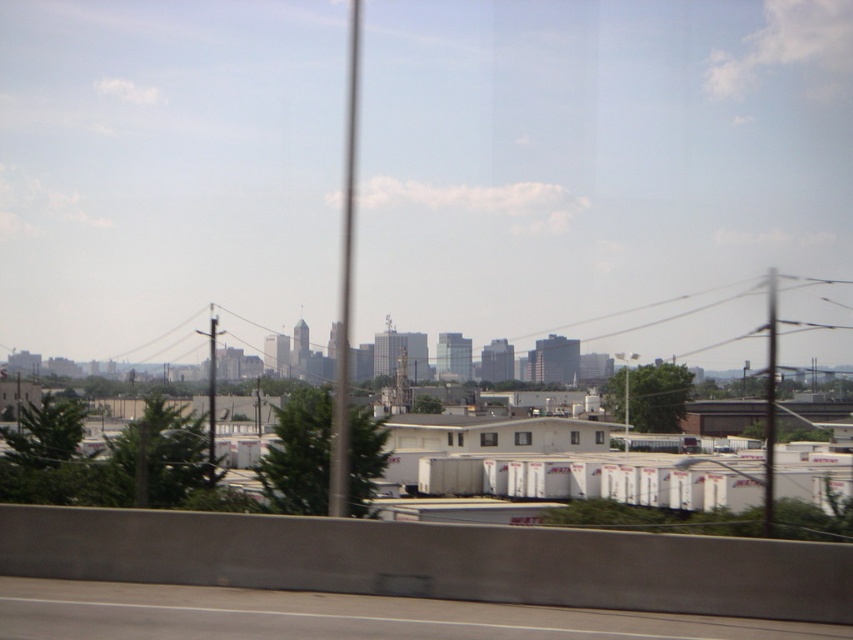
You are driving on the highway and want to know if you can safely pass between the gray asphalt highway at lower center and the metallic pole at right without hitting the pole. The distance between them is 64.74 feet. Your car is 15 feet wide. Can you safely pass through the space between them?

The distance between the gray asphalt highway at lower center and the metallic pole at right is 64.74 feet. Since your car is only 15 feet wide, there is more than enough space to safely pass through the gap without hitting the pole.

You are standing in the urban landscape scene and want to move from the point closer to you to the point further away. Which path would you take between the two points, point (25, 616) and point (358, 65)?

The path from point (25, 616) to point (358, 65) would involve moving away from the viewer since point (25, 616) is closer to the viewer than point (358, 65).